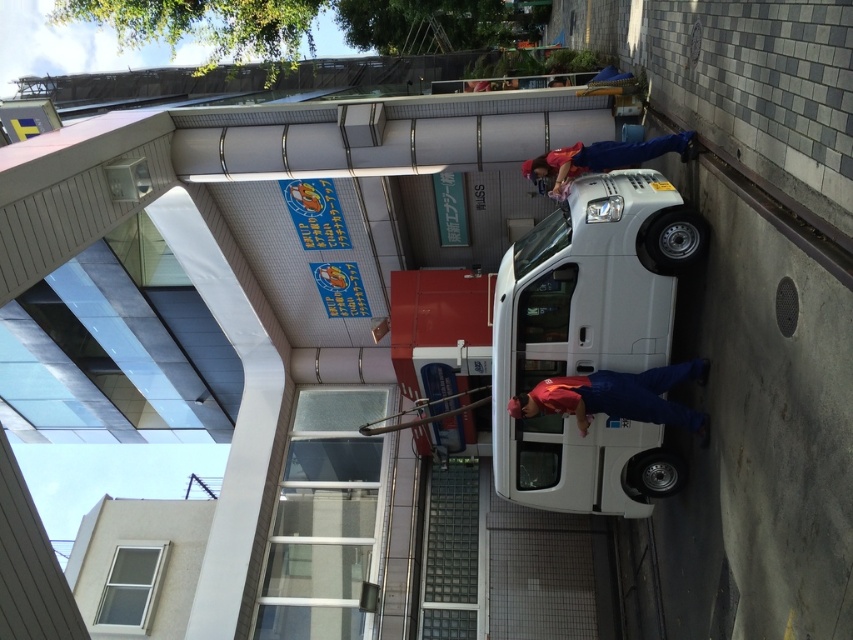
Question: Which point appears farthest from the camera in this image?

Choices:
 (A) (548, 156)
 (B) (683, 376)

Answer: (A)

Question: Estimate the real-world distances between objects in this image. Which object is closer to the white glossy van at center?

Choices:
 (A) matte red shirt at upper right
 (B) red matte uniform at center

Answer: (B)

Question: Can you confirm if red matte uniform at center is bigger than matte red shirt at upper right?

Choices:
 (A) no
 (B) yes

Answer: (A)

Question: Which point is closer to the camera?

Choices:
 (A) (521, 314)
 (B) (695, 154)

Answer: (B)

Question: Observing the image, what is the correct spatial positioning of white glossy van at center in reference to matte red shirt at upper right?

Choices:
 (A) right
 (B) left

Answer: (B)

Question: Is red matte uniform at center further to camera compared to matte red shirt at upper right?

Choices:
 (A) yes
 (B) no

Answer: (A)